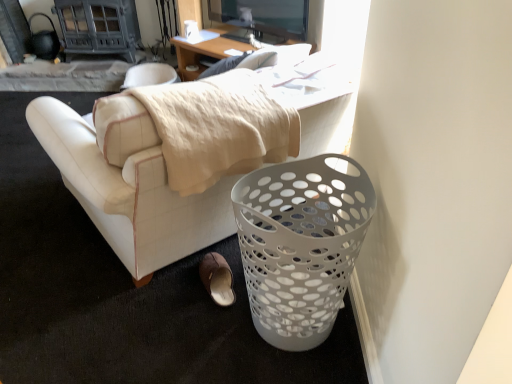
Question: Is white perforated trash bin at lower right to the right of white leather couch at center from the viewer's perspective?

Choices:
 (A) yes
 (B) no

Answer: (A)

Question: Is white perforated trash bin at lower right far from white leather couch at center?

Choices:
 (A) yes
 (B) no

Answer: (B)

Question: Could white leather couch at center be considered to be inside white perforated trash bin at lower right?

Choices:
 (A) no
 (B) yes

Answer: (A)

Question: Considering the relative sizes of white perforated trash bin at lower right and white leather couch at center in the image provided, is white perforated trash bin at lower right thinner than white leather couch at center?

Choices:
 (A) yes
 (B) no

Answer: (A)

Question: Can you confirm if white perforated trash bin at lower right is wider than white leather couch at center?

Choices:
 (A) yes
 (B) no

Answer: (B)

Question: In the image, is white perforated trash bin at lower right on the left side or the right side of white leather couch at center?

Choices:
 (A) left
 (B) right

Answer: (B)

Question: From a real-world perspective, is white perforated trash bin at lower right above or below white leather couch at center?

Choices:
 (A) below
 (B) above

Answer: (A)

Question: Is white perforated trash bin at lower right taller or shorter than white leather couch at center?

Choices:
 (A) short
 (B) tall

Answer: (B)

Question: Is point (307, 208) closer or farther from the camera than point (329, 82)?

Choices:
 (A) closer
 (B) farther

Answer: (A)

Question: From the image's perspective, is brown suede slipper at lower center located above or below white leather couch at center?

Choices:
 (A) below
 (B) above

Answer: (A)

Question: Is brown suede slipper at lower center taller or shorter than white leather couch at center?

Choices:
 (A) short
 (B) tall

Answer: (A)

Question: Do you think brown suede slipper at lower center is within white leather couch at center, or outside of it?

Choices:
 (A) inside
 (B) outside

Answer: (B)

Question: Based on their sizes in the image, would you say brown suede slipper at lower center is bigger or smaller than white leather couch at center?

Choices:
 (A) small
 (B) big

Answer: (A)

Question: From the image's perspective, is brown suede slipper at lower center located above or below white perforated trash bin at lower right?

Choices:
 (A) above
 (B) below

Answer: (B)

Question: Looking at their shapes, would you say brown suede slipper at lower center is wider or thinner than white perforated trash bin at lower right?

Choices:
 (A) wide
 (B) thin

Answer: (B)